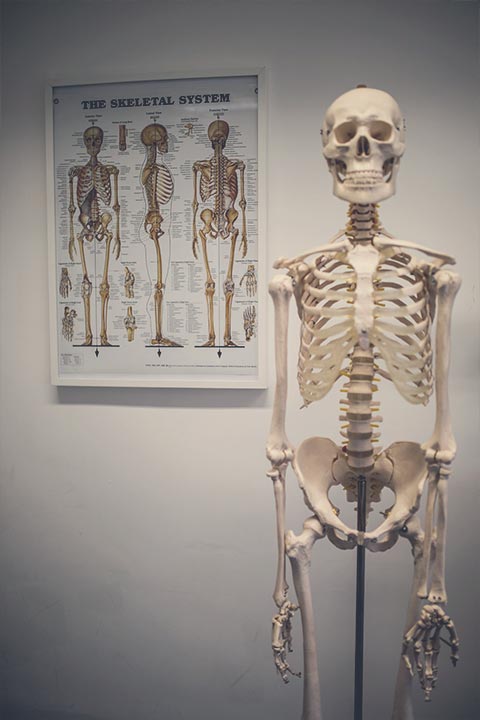
Identify the location of shadowed corner. (16, 8), (460, 14), (19, 693), (469, 698).